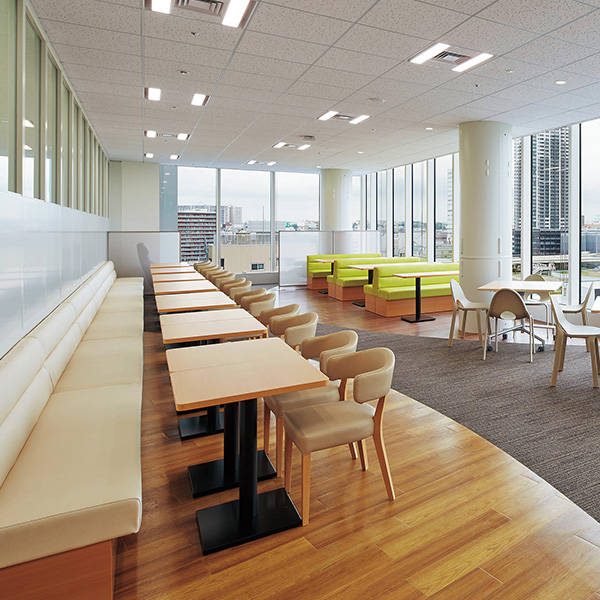
Identify the location of feet of tables. This screenshot has width=600, height=600. (228, 532), (208, 487), (193, 431), (181, 411), (418, 319), (358, 299), (321, 290).